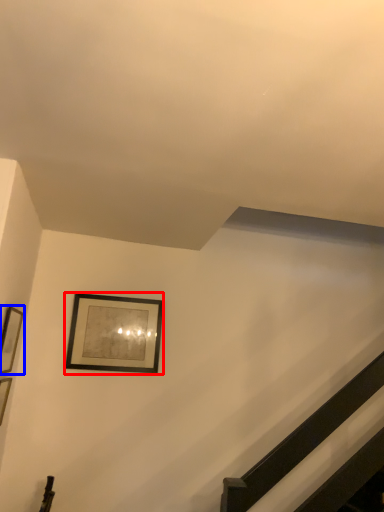
Question: Which object is closer to the camera taking this photo, picture frame (highlighted by a red box) or picture frame (highlighted by a blue box)?

Choices:
 (A) picture frame
 (B) picture frame

Answer: (B)